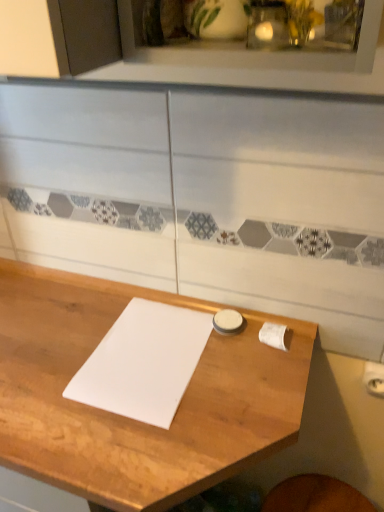
Question: From a real-world perspective, is white matte journal at center positioned over wooden table at center based on gravity?

Choices:
 (A) no
 (B) yes

Answer: (B)

Question: Does white matte journal at center have a greater width compared to wooden table at center?

Choices:
 (A) no
 (B) yes

Answer: (A)

Question: Considering the relative positions of white matte journal at center and wooden table at center in the image provided, is white matte journal at center to the left of wooden table at center from the viewer's perspective?

Choices:
 (A) no
 (B) yes

Answer: (A)

Question: Does white matte journal at center appear on the right side of wooden table at center?

Choices:
 (A) no
 (B) yes

Answer: (B)

Question: Considering the relative sizes of white matte journal at center and wooden table at center in the image provided, is white matte journal at center thinner than wooden table at center?

Choices:
 (A) no
 (B) yes

Answer: (B)

Question: Is the depth of white matte journal at center less than that of wooden table at center?

Choices:
 (A) no
 (B) yes

Answer: (A)

Question: Considering the relative sizes of wooden table at center and white matte journal at center in the image provided, is wooden table at center shorter than white matte journal at center?

Choices:
 (A) no
 (B) yes

Answer: (A)

Question: Can you confirm if wooden table at center is bigger than white matte journal at center?

Choices:
 (A) no
 (B) yes

Answer: (B)

Question: Is wooden table at center thinner than white matte journal at center?

Choices:
 (A) no
 (B) yes

Answer: (A)

Question: Could you tell me if wooden table at center is facing white matte journal at center?

Choices:
 (A) no
 (B) yes

Answer: (A)

Question: Is wooden table at center to the right of white matte journal at center from the viewer's perspective?

Choices:
 (A) yes
 (B) no

Answer: (B)

Question: Is wooden table at center positioned with its back to white matte journal at center?

Choices:
 (A) no
 (B) yes

Answer: (A)

Question: Is point (104, 398) closer or farther from the camera than point (167, 498)?

Choices:
 (A) closer
 (B) farther

Answer: (B)